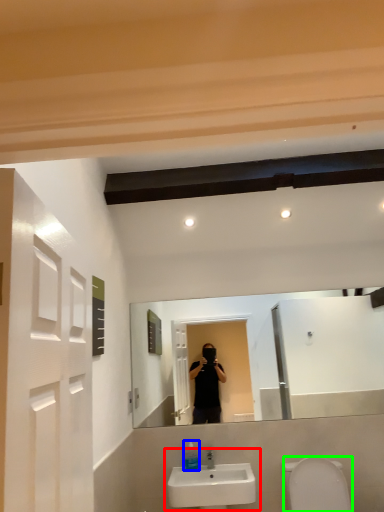
Question: Based on their relative distances, which object is nearer to sink (highlighted by a red box)? Choose from soap dispenser (highlighted by a blue box) and toilet bowl (highlighted by a green box).

Choices:
 (A) soap dispenser
 (B) toilet bowl

Answer: (A)